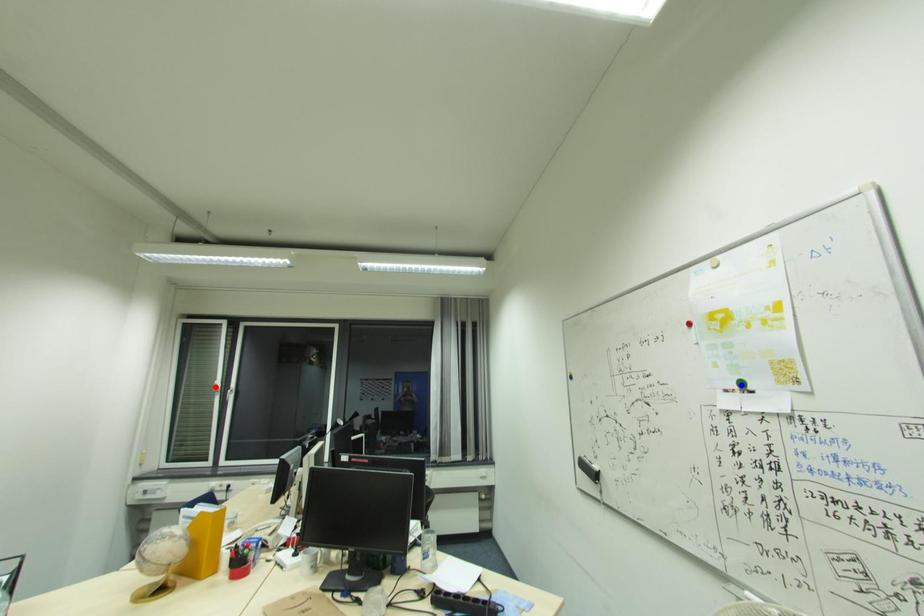
Question: In the image, two points are highlighted. Which point is nearer to the camera? Reply with the corresponding letter.

Choices:
 (A) blue point
 (B) red point

Answer: (A)